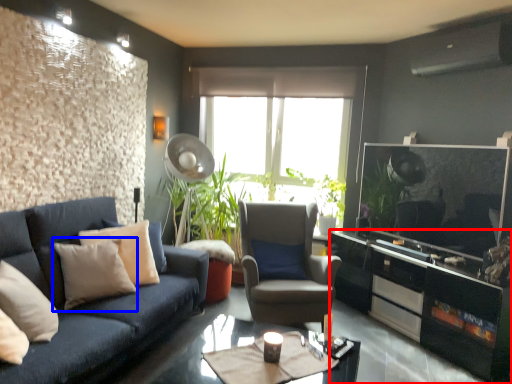
Question: Which of the following is the farthest to the observer, cabinetry (highlighted by a red box) or pillow (highlighted by a blue box)?

Choices:
 (A) cabinetry
 (B) pillow

Answer: (A)